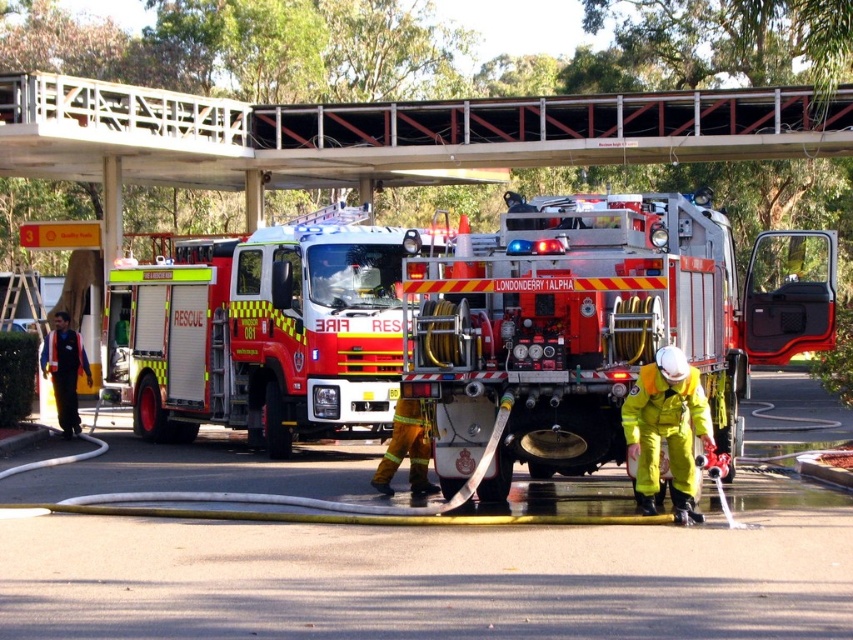
You are a firefighter trying to exit the scene quickly. The red reflective fire truck at center is blocking your path to the white metal bridge at upper center. Can you move the fire truck to get to the bridge?

The red reflective fire truck at center is positioned under the white metal bridge at upper center, so moving it might be possible depending on space constraints not specified here. However, since the truck is under the bridge, there might be clearance issues. Without additional details on the area, it is uncertain if moving the truck would allow access to the bridge.